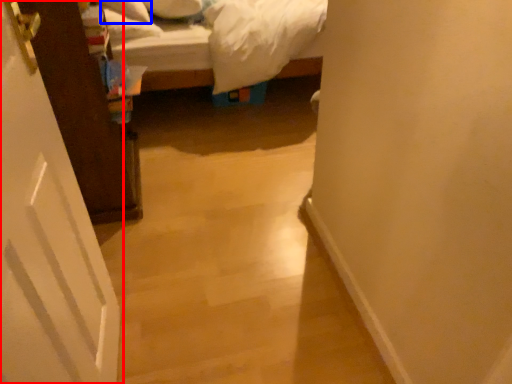
Question: Among these objects, which one is farthest to the camera, door (highlighted by a red box) or pillow (highlighted by a blue box)?

Choices:
 (A) door
 (B) pillow

Answer: (B)